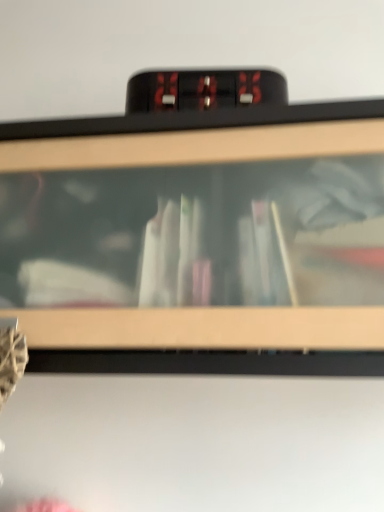
Describe the element at coordinates (184, 225) in the screenshot. This screenshot has height=512, width=384. I see `transparent glass shelf at upper center` at that location.

Identify the location of transparent glass shelf at upper center. click(184, 225).

At what (x,y) coordinates should I click in order to perform the action: click on transparent glass shelf at upper center. Please return your answer as a coordinate pair (x, y). Image resolution: width=384 pixels, height=512 pixels. Looking at the image, I should click on (184, 225).